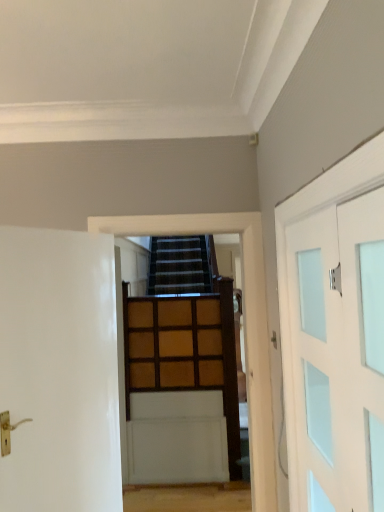
The height and width of the screenshot is (512, 384). In order to click on wooden paneling at center in this screenshot , I will do `click(244, 321)`.

The width and height of the screenshot is (384, 512). Describe the element at coordinates (59, 371) in the screenshot. I see `white glossy door at left, the second door when ordered from right to left` at that location.

This screenshot has height=512, width=384. What do you see at coordinates (338, 355) in the screenshot?
I see `white frosted glass door at right, the 2th door in the left-to-right sequence` at bounding box center [338, 355].

The width and height of the screenshot is (384, 512). In order to click on wooden paneling at center in this screenshot , I will do `click(244, 321)`.

Can you confirm if white glossy door at left, marked as the 1th door in a left-to-right arrangement, is shorter than wooden paneling at center?

No.

Is white glossy door at left, the second door when ordered from right to left, at the right side of wooden paneling at center?

No.

Is white glossy door at left, marked as the 1th door in a left-to-right arrangement, positioned far away from wooden paneling at center?

Indeed, white glossy door at left, marked as the 1th door in a left-to-right arrangement, is not near wooden paneling at center.

From the image's perspective, is white glossy door at left, marked as the 1th door in a left-to-right arrangement, positioned above or below wooden paneling at center?

Based on their image positions, white glossy door at left, marked as the 1th door in a left-to-right arrangement, is located above wooden paneling at center.

Is the surface of wooden paneling at center in direct contact with white glossy door at left, the second door when ordered from right to left?

There is a gap between wooden paneling at center and white glossy door at left, the second door when ordered from right to left.

Between wooden paneling at center and white glossy door at left, marked as the 1th door in a left-to-right arrangement, which one appears on the right side from the viewer's perspective?

Positioned to the right is wooden paneling at center.

Which object is closer to the camera, wooden paneling at center or white glossy door at left, the second door when ordered from right to left?

white glossy door at left, the second door when ordered from right to left, is closer to the camera.

From the picture: From a real-world perspective, between wooden paneling at center and white glossy door at left, marked as the 1th door in a left-to-right arrangement, who is vertically lower?

white glossy door at left, marked as the 1th door in a left-to-right arrangement, from a real-world perspective.

Is point (68, 327) positioned after point (205, 221)?

No, (68, 327) is closer to viewer.

Is white glossy door at left, the second door when ordered from right to left, facing away from wooden paneling at center?

No, white glossy door at left, the second door when ordered from right to left, is not facing away from wooden paneling at center.

Who is smaller, white glossy door at left, the second door when ordered from right to left, or wooden paneling at center?

white glossy door at left, the second door when ordered from right to left.

How different are the orientations of wooden paneling at center and white frosted glass door at right, the 1th door when ordered from right to left, in degrees?

The angle between the facing direction of wooden paneling at center and the facing direction of white frosted glass door at right, the 1th door when ordered from right to left, is 90.2 degrees.

From the picture: Does wooden paneling at center turn towards white frosted glass door at right, the 2th door in the left-to-right sequence?

Yes, wooden paneling at center is oriented towards white frosted glass door at right, the 2th door in the left-to-right sequence.

Consider the image. From the image's perspective, is wooden paneling at center located above or below white frosted glass door at right, the 2th door in the left-to-right sequence?

wooden paneling at center is situated lower than white frosted glass door at right, the 2th door in the left-to-right sequence, in the image.

Looking at this image, considering the positions of objects wooden paneling at center and wooden paneling at center in the image provided, who is more to the left, wooden paneling at center or wooden paneling at center?

Positioned to the left is wooden paneling at center.

Is wooden paneling at center at the back of wooden paneling at center?

Yes, wooden paneling at center is positioned with its back facing wooden paneling at center.

From the image's perspective, is wooden paneling at center on wooden paneling at center?

Yes, from the image's perspective, wooden paneling at center is above wooden paneling at center.

Which object is further away from the camera taking this photo, wooden paneling at center or wooden paneling at center?

Positioned behind is wooden paneling at center.

Where is `garage door lying below the white frosted glass door at right, the 2th door in the left-to-right sequence (from the image's perspective)`? garage door lying below the white frosted glass door at right, the 2th door in the left-to-right sequence (from the image's perspective) is located at coordinates (244, 321).

Which is more to the left, wooden paneling at center or white frosted glass door at right, the 1th door when ordered from right to left?

wooden paneling at center.

Which of these two, wooden paneling at center or white frosted glass door at right, the 2th door in the left-to-right sequence, stands shorter?

With less height is white frosted glass door at right, the 2th door in the left-to-right sequence.

Is wooden paneling at center placed right next to white frosted glass door at right, the 1th door when ordered from right to left?

wooden paneling at center and white frosted glass door at right, the 1th door when ordered from right to left, are clearly separated.

Is white frosted glass door at right, the 1th door when ordered from right to left, looking in the opposite direction of wooden paneling at center?

That's not correct — white frosted glass door at right, the 1th door when ordered from right to left, is not looking away from wooden paneling at center.

Considering the relative positions of white frosted glass door at right, the 2th door in the left-to-right sequence, and wooden paneling at center in the image provided, is white frosted glass door at right, the 2th door in the left-to-right sequence, to the left of wooden paneling at center from the viewer's perspective?

Incorrect, white frosted glass door at right, the 2th door in the left-to-right sequence, is not on the left side of wooden paneling at center.

What's the angular difference between white frosted glass door at right, the 1th door when ordered from right to left, and wooden paneling at center's facing directions?

The angle between the facing direction of white frosted glass door at right, the 1th door when ordered from right to left, and the facing direction of wooden paneling at center is 90.2 degrees.

Is white frosted glass door at right, the 2th door in the left-to-right sequence, next to wooden paneling at center?

No, white frosted glass door at right, the 2th door in the left-to-right sequence, is not with wooden paneling at center.

Identify the location of door on the left side of wooden paneling at center. click(59, 371).

Image resolution: width=384 pixels, height=512 pixels. I want to click on garage door positioned vertically above the white glossy door at left, the second door when ordered from right to left (from a real-world perspective), so click(244, 321).

Which object lies nearer to the anchor point white glossy door at left, the second door when ordered from right to left, white frosted glass door at right, the 2th door in the left-to-right sequence, or wooden paneling at center?

white frosted glass door at right, the 2th door in the left-to-right sequence, lies closer to white glossy door at left, the second door when ordered from right to left, than the other object.

Considering their positions, is wooden paneling at center positioned further to wooden paneling at center than white glossy door at left, the second door when ordered from right to left?

Based on the image, wooden paneling at center appears to be further to wooden paneling at center.

Considering their positions, is wooden paneling at center positioned further to white frosted glass door at right, the 1th door when ordered from right to left, than wooden paneling at center?

Among the two, wooden paneling at center is located further to white frosted glass door at right, the 1th door when ordered from right to left.

Estimate the real-world distances between objects in this image. Which object is closer to white glossy door at left, marked as the 1th door in a left-to-right arrangement, white frosted glass door at right, the 2th door in the left-to-right sequence, or wooden paneling at center?

Based on the image, wooden paneling at center appears to be nearer to white glossy door at left, marked as the 1th door in a left-to-right arrangement.

Looking at the image, which one is located further to white frosted glass door at right, the 2th door in the left-to-right sequence, wooden paneling at center or wooden paneling at center?

wooden paneling at center is positioned further to the anchor white frosted glass door at right, the 2th door in the left-to-right sequence.

Considering their positions, is white glossy door at left, marked as the 1th door in a left-to-right arrangement, positioned closer to white frosted glass door at right, the 1th door when ordered from right to left, than wooden paneling at center?

wooden paneling at center.

Looking at the image, which one is located further to white glossy door at left, the second door when ordered from right to left, wooden paneling at center or wooden paneling at center?

wooden paneling at center.

Looking at the image, which one is located further to wooden paneling at center, white glossy door at left, the second door when ordered from right to left, or white frosted glass door at right, the 2th door in the left-to-right sequence?

Based on the image, white frosted glass door at right, the 2th door in the left-to-right sequence, appears to be further to wooden paneling at center.

Locate an element on the screen. Image resolution: width=384 pixels, height=512 pixels. door between white frosted glass door at right, the 2th door in the left-to-right sequence, and wooden paneling at center in the front-back direction is located at coordinates (59, 371).

Identify the location of garage door located between white glossy door at left, marked as the 1th door in a left-to-right arrangement, and wooden paneling at center in the depth direction. (244, 321).

Locate an element on the screen. door between white frosted glass door at right, the 1th door when ordered from right to left, and wooden paneling at center, along the z-axis is located at coordinates (59, 371).

At what (x,y) coordinates should I click in order to perform the action: click on garage door between white frosted glass door at right, the 2th door in the left-to-right sequence, and wooden paneling at center in the front-back direction. Please return your answer as a coordinate pair (x, y). This screenshot has height=512, width=384. Looking at the image, I should click on (244, 321).